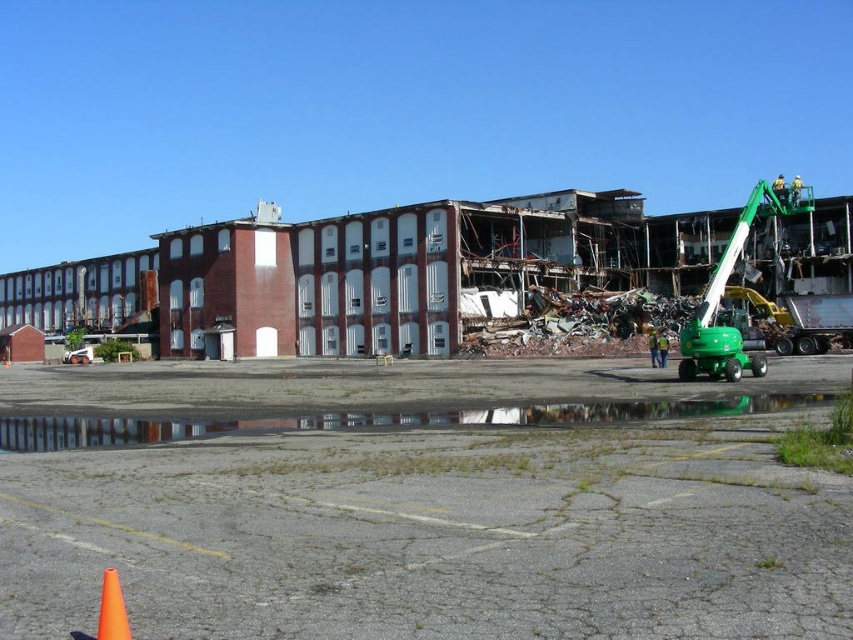
Question: Where is green rubber tractor at center located in relation to green rubber excavator at right in the image?

Choices:
 (A) above
 (B) below

Answer: (B)

Question: Which point is farther to the camera?

Choices:
 (A) orange plastic traffic cone at lower left
 (B) reflective concrete puddle at lower center
 (C) green rubber excavator at right
 (D) rusty metal debris at center

Answer: (D)

Question: Observing the image, what is the correct spatial positioning of rusty metal debris at center in reference to orange plastic traffic cone at lower left?

Choices:
 (A) left
 (B) right

Answer: (A)

Question: Does green rubber tractor at center appear over rusty metal debris at center?

Choices:
 (A) no
 (B) yes

Answer: (A)

Question: Among these objects, which one is nearest to the camera?

Choices:
 (A) reflective concrete puddle at lower center
 (B) rusty metal debris at center

Answer: (A)

Question: Among these points, which one is nearest to the camera?

Choices:
 (A) (97, 634)
 (B) (532, 420)

Answer: (A)